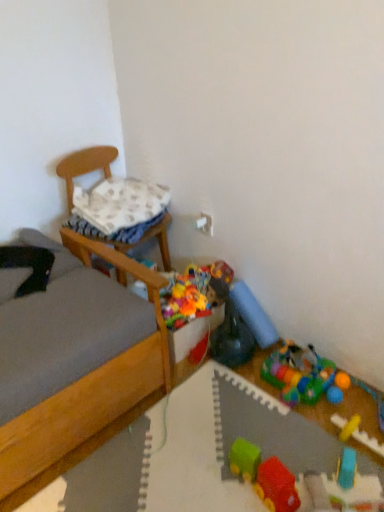
At what (x,y) coordinates should I click in order to perform the action: click on vacant space behind blue rubber toy at lower right, which is the 3th toy from front to back. Please return your answer as a coordinate pair (x, y). This screenshot has height=512, width=384. Looking at the image, I should click on (333, 432).